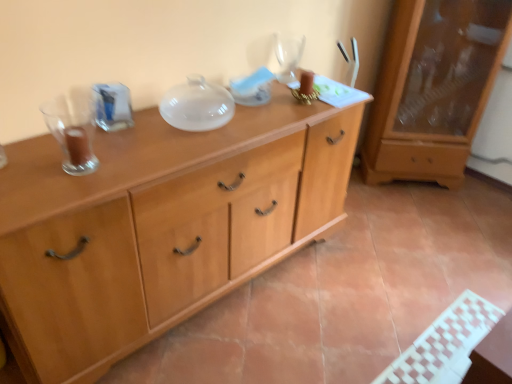
The height and width of the screenshot is (384, 512). In order to click on vacant area that is situated to the right of light wood cabinet at center in this screenshot , I will do `click(373, 279)`.